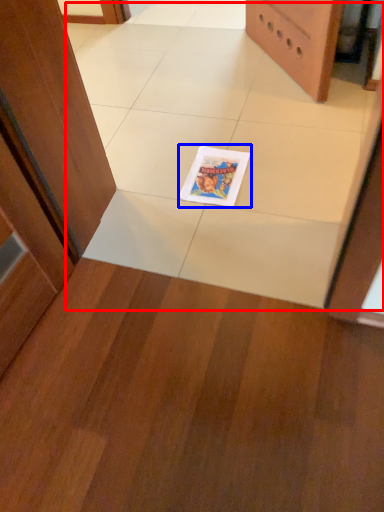
Question: Which point is closer to the camera, ceramic tile (highlighted by a red box) or comic book (highlighted by a blue box)?

Choices:
 (A) ceramic tile
 (B) comic book

Answer: (A)